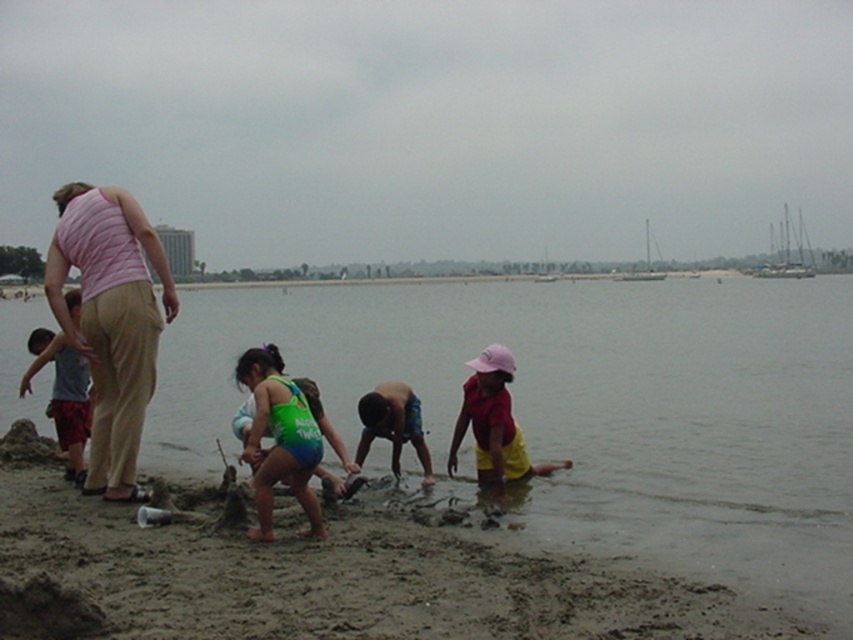
Is pink striped shirt at upper left closer to the viewer compared to pink fabric hat at lower center?

Yes, it is.

From the picture: Between pink striped shirt at upper left and pink fabric hat at lower center, which one is positioned higher?

pink striped shirt at upper left is higher up.

Which is in front, point (115, 483) or point (485, 480)?

Point (115, 483) is in front.

Image resolution: width=853 pixels, height=640 pixels. Identify the location of pink striped shirt at upper left. (111, 321).

Who is higher up, green swimsuit at center or multicolored striped shorts at center?

green swimsuit at center

Does green swimsuit at center have a lesser height compared to multicolored striped shorts at center?

No, green swimsuit at center is not shorter than multicolored striped shorts at center.

Who is more forward, (241, 362) or (396, 388)?

Point (241, 362) is more forward.

I want to click on green swimsuit at center, so click(x=279, y=440).

Can you confirm if green swimsuit at center is thinner than pink fabric hat at lower center?

Yes, green swimsuit at center is thinner than pink fabric hat at lower center.

Who is more forward, (268, 496) or (508, 480)?

Point (268, 496)

The width and height of the screenshot is (853, 640). Identify the location of green swimsuit at center. (279, 440).